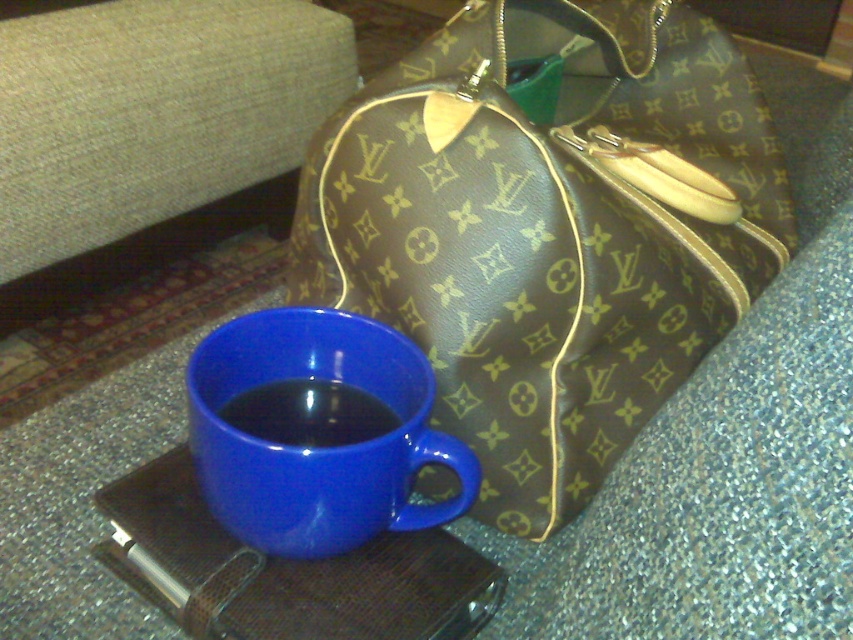
Does brown monogrammed bag at center lie in front of matte blue cup at center?

Yes, brown monogrammed bag at center is closer to the viewer.

Can you confirm if brown monogrammed bag at center is smaller than matte blue cup at center?

Incorrect, brown monogrammed bag at center is not smaller in size than matte blue cup at center.

What do you see at coordinates (547, 232) in the screenshot? I see `brown monogrammed bag at center` at bounding box center [547, 232].

The height and width of the screenshot is (640, 853). What are the coordinates of `brown monogrammed bag at center` in the screenshot? It's located at (547, 232).

Is point (143, 248) closer to camera compared to point (277, 444)?

No, (143, 248) is behind (277, 444).

Is point (289, 131) positioned behind point (355, 442)?

Yes, point (289, 131) is behind point (355, 442).

This screenshot has width=853, height=640. What are the coordinates of `beige fabric couch at upper left` in the screenshot? It's located at (154, 132).

Can you confirm if brown monogrammed bag at center is positioned to the right of beige fabric couch at upper left?

Correct, you'll find brown monogrammed bag at center to the right of beige fabric couch at upper left.

Does brown monogrammed bag at center have a lesser width compared to beige fabric couch at upper left?

Indeed, brown monogrammed bag at center has a lesser width compared to beige fabric couch at upper left.

Where is `brown monogrammed bag at center`? This screenshot has height=640, width=853. brown monogrammed bag at center is located at coordinates (547, 232).

Locate an element on the screen. The height and width of the screenshot is (640, 853). brown monogrammed bag at center is located at coordinates (547, 232).